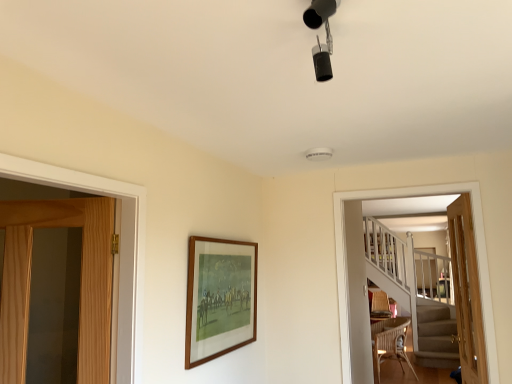
Question: From the image's perspective, is woven brown chair at lower right above or below wooden screen door at right?

Choices:
 (A) below
 (B) above

Answer: (A)

Question: Is point (387, 326) closer or farther from the camera than point (346, 377)?

Choices:
 (A) closer
 (B) farther

Answer: (B)

Question: Which is nearer to the light wood door at right, the 2th door viewed from the left?

Choices:
 (A) woven brown chair at lower right
 (B) wooden frame at center
 (C) matte black track lights at upper center
 (D) wicker armchair at lower right
 (E) wooden screen door at right

Answer: (E)

Question: Based on their relative distances, which object is nearer to the matte black track lights at upper center?

Choices:
 (A) woven brown chair at lower right
 (B) wicker armchair at lower right
 (C) light brown wooden door at left, which is counted as the first door, starting from the left
 (D) wooden screen door at right
 (E) wooden frame at center

Answer: (C)